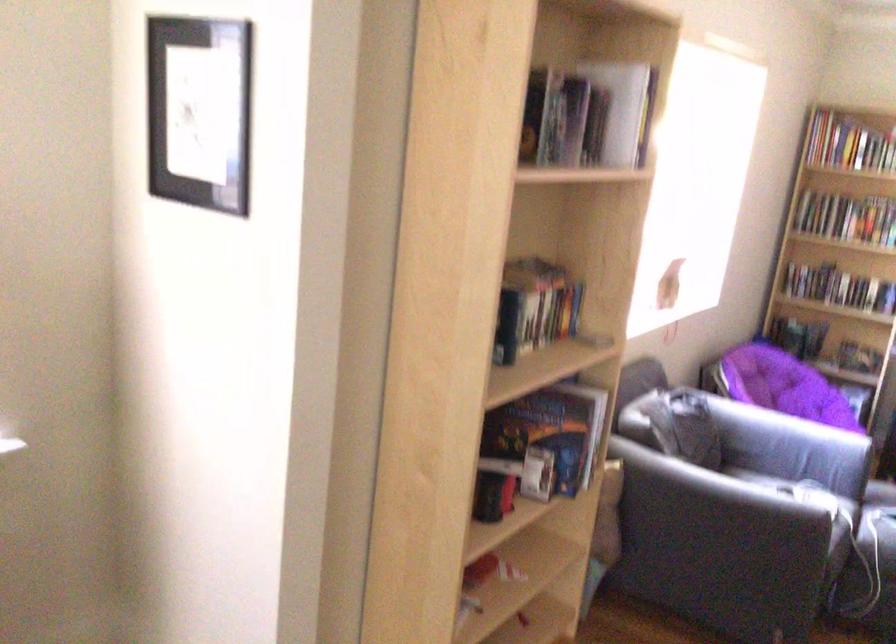
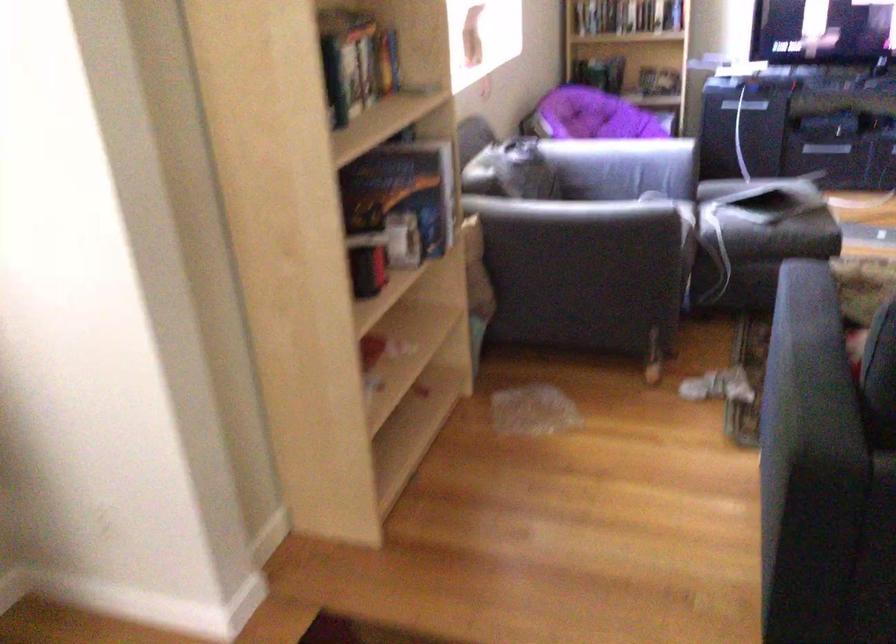
The point at (789, 422) is marked in the first image. Where is the corresponding point in the second image?

(612, 149)